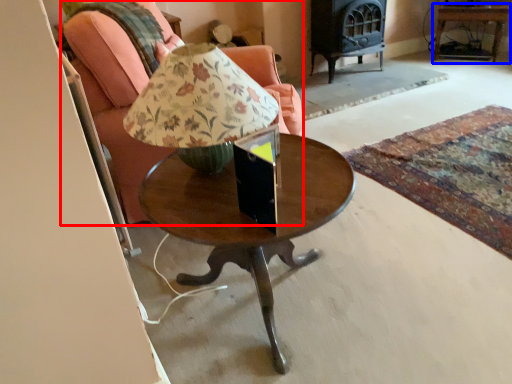
Question: Which object is further to the camera taking this photo, chair (highlighted by a red box) or side table (highlighted by a blue box)?

Choices:
 (A) chair
 (B) side table

Answer: (B)